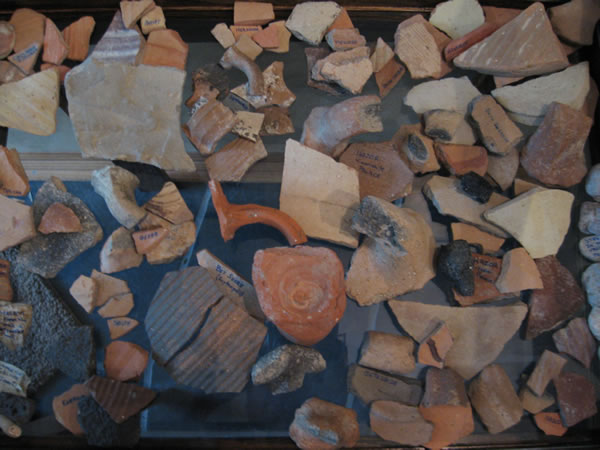
At what (x,y) coordinates should I click in order to perform the action: click on glass surface. Please return your answer as a coordinate pair (x, y). This screenshot has width=600, height=450. Looking at the image, I should click on (348, 337), (263, 182), (69, 171), (401, 108).